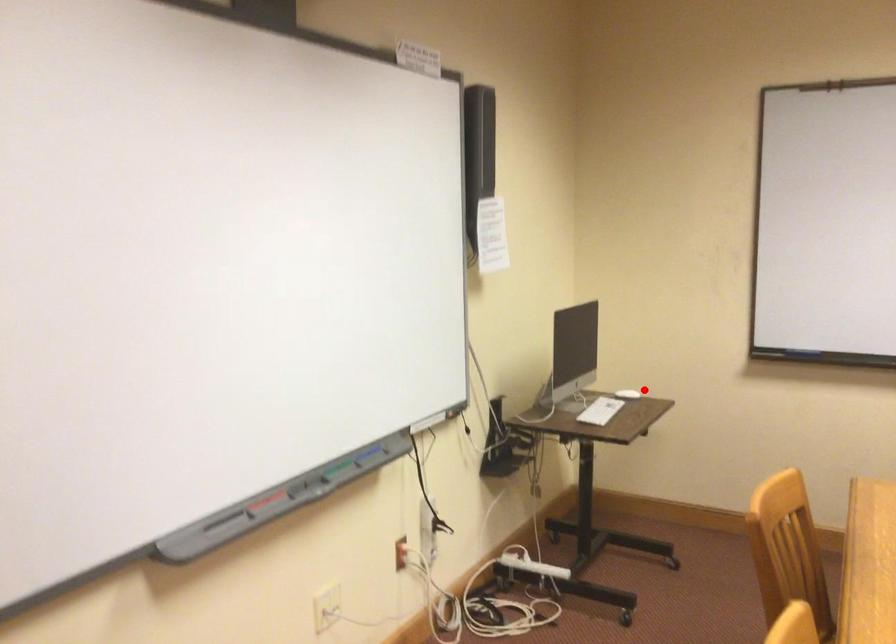
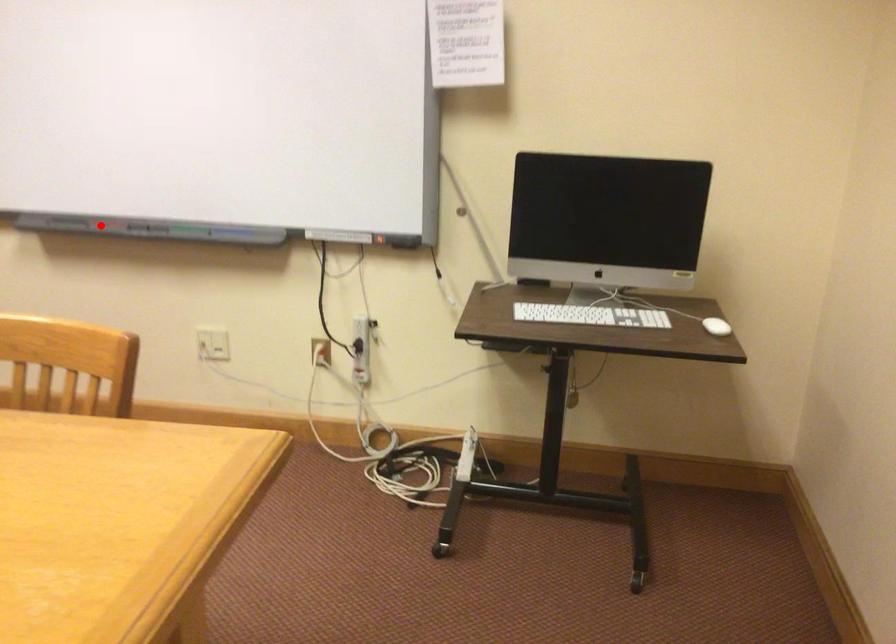
Consider the image. I am providing you with two images of the same scene from different viewpoints. A red point is marked on the first image and another point is marked on the second image. Is the red point in image1 aligned with the point shown in image2?

No